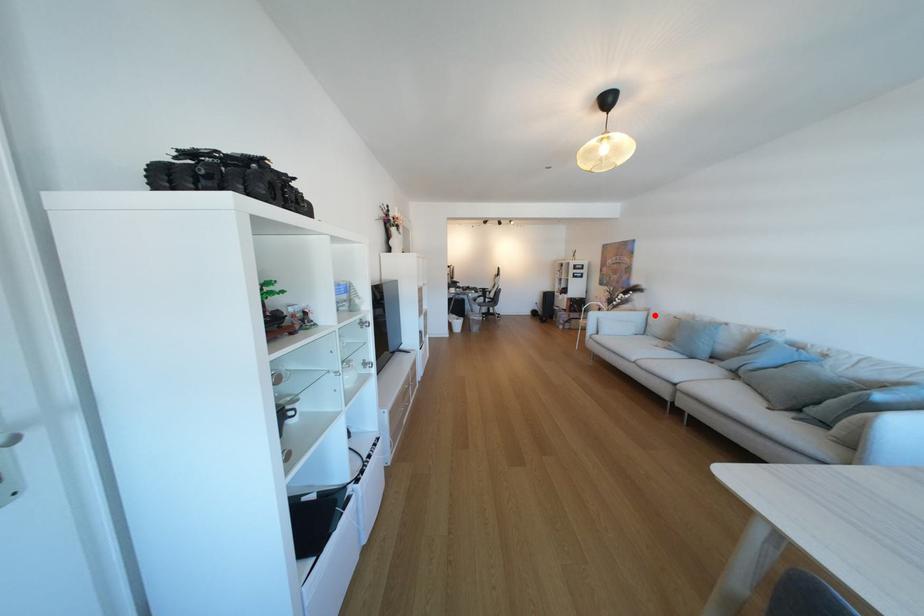
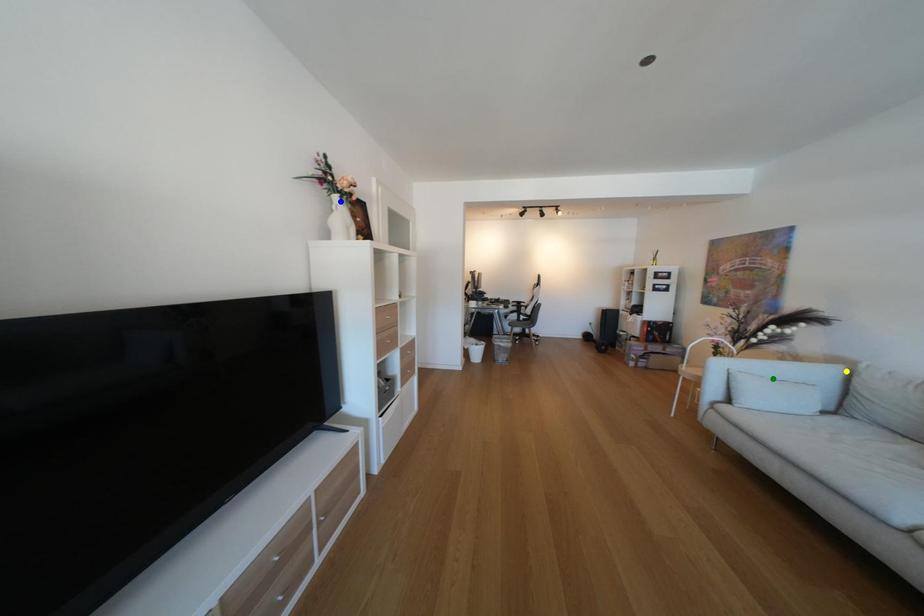
Question: I am providing you with two images of the same scene from different viewpoints. A red point is marked on the first image. You are given multiple points on the second image. Which mark in image 2 goes with the point in image 1?

Choices:
 (A) yellow point
 (B) green point
 (C) blue point

Answer: (A)